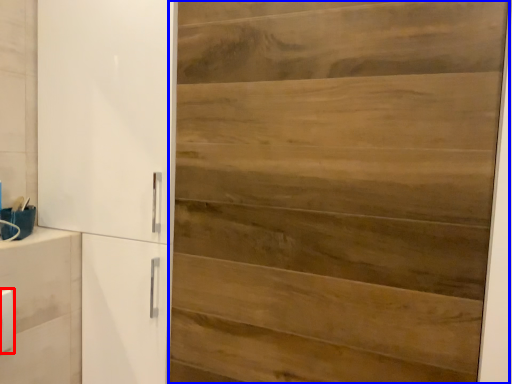
Question: Which of the following is the farthest to the observer, light switch (highlighted by a red box) or door (highlighted by a blue box)?

Choices:
 (A) light switch
 (B) door

Answer: (A)